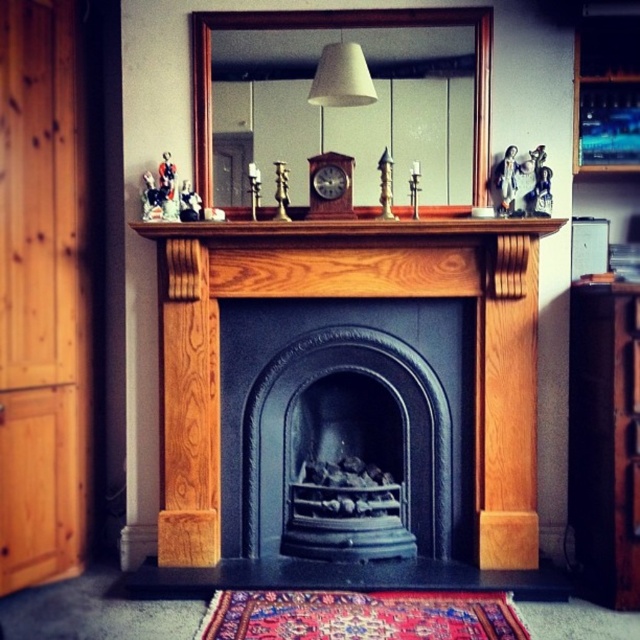
Question: Is wooden fireplace at center bigger than wooden mantelpiece at center?

Choices:
 (A) yes
 (B) no

Answer: (A)

Question: Does wooden armoire at left have a larger size compared to matte white lampshade at upper center?

Choices:
 (A) no
 (B) yes

Answer: (B)

Question: Is wooden fireplace at center closer to camera compared to wooden armoire at left?

Choices:
 (A) yes
 (B) no

Answer: (B)

Question: Which point is farther to the camera?

Choices:
 (A) (353, 324)
 (B) (525, 582)
 (C) (316, 72)
 (D) (568, 426)

Answer: (D)

Question: Which point is closer to the camera?

Choices:
 (A) (58, 164)
 (B) (572, 433)

Answer: (A)

Question: Which point is closer to the camera?

Choices:
 (A) black cast iron fireplace at center
 (B) wooden armoire at left
 (C) wooden fireplace at center
 (D) matte white lampshade at upper center

Answer: (B)